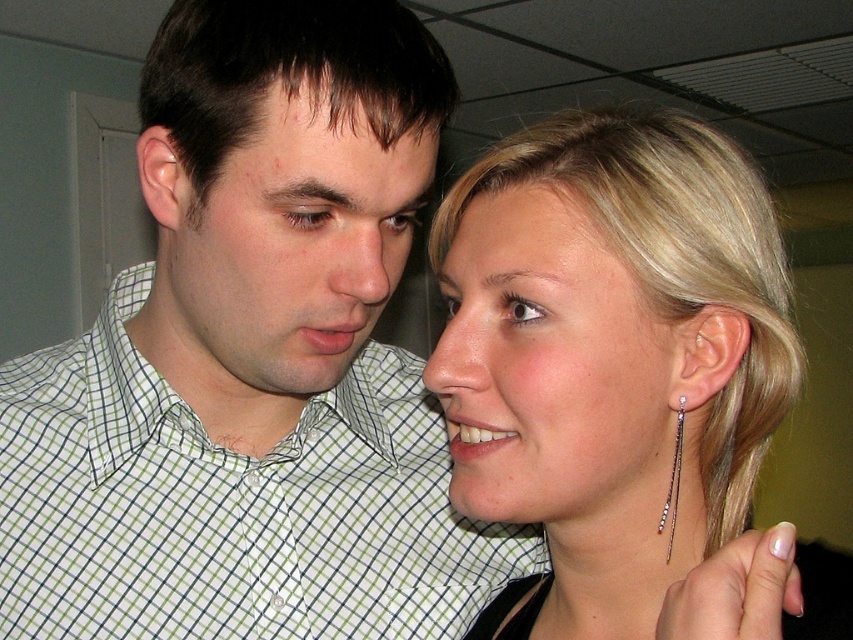
Question: Can you confirm if sleek silver earrings at upper right is positioned to the left of matte green checkered shirt at center?

Choices:
 (A) yes
 (B) no

Answer: (B)

Question: Based on their relative distances, which object is nearer to the sleek silver earrings at upper right?

Choices:
 (A) pale skin at center
 (B) green checkered shirt at upper left
 (C) matte green checkered shirt at center
 (D) silver/diamonds earring at right

Answer: (A)

Question: Which point is closer to the camera?

Choices:
 (A) (358, 109)
 (B) (289, 108)
 (C) (718, 237)
 (D) (490, 480)

Answer: (D)

Question: Which point is closer to the camera?

Choices:
 (A) silver/diamonds earring at right
 (B) matte skin at upper center
 (C) green checkered shirt at upper left

Answer: (A)

Question: Is green checkered shirt at upper left bigger than matte skin at upper center?

Choices:
 (A) yes
 (B) no

Answer: (A)

Question: Is pale skin at center below matte green checkered shirt at center?

Choices:
 (A) no
 (B) yes

Answer: (B)